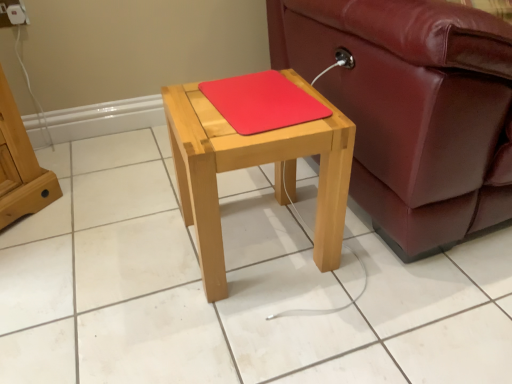
Question: Is leather couch at right taller or shorter than white plastic electric outlet at upper left?

Choices:
 (A) short
 (B) tall

Answer: (B)

Question: Is leather couch at right spatially inside white plastic electric outlet at upper left, or outside of it?

Choices:
 (A) inside
 (B) outside

Answer: (B)

Question: Which is nearer to the natural wood table at center?

Choices:
 (A) leather couch at right
 (B) white plastic electric outlet at upper left
 (C) rubberized red mousepad at center

Answer: (C)

Question: Considering the real-world distances, which object is closest to the natural wood table at center?

Choices:
 (A) white plastic electric outlet at upper left
 (B) leather couch at right
 (C) rubberized red mousepad at center

Answer: (C)